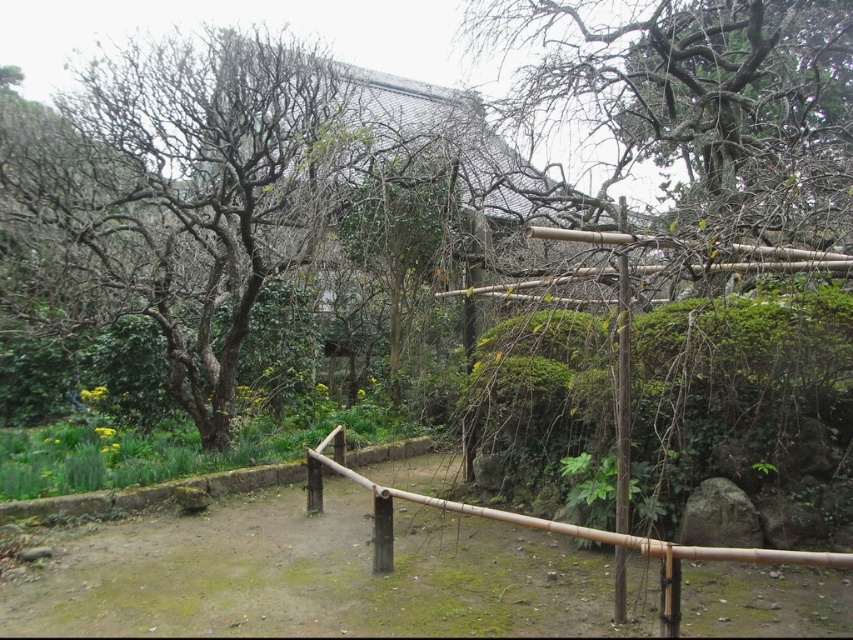
Does point (22, 129) lie in front of point (621, 497)?

No, (22, 129) is further to viewer.

Who is positioned more to the left, bare wood tree at left or bamboo pole at center?

bare wood tree at left is more to the left.

Does point (223, 61) come behind point (624, 200)?

That is True.

The image size is (853, 640). I want to click on bare wood tree at left, so click(x=186, y=189).

Is bamboo fence at center below bamboo pole at center?

Indeed, bamboo fence at center is positioned under bamboo pole at center.

Who is more forward, (666, 552) or (628, 422)?

Point (666, 552) is in front.

Where is `bamboo fence at center`? This screenshot has height=640, width=853. bamboo fence at center is located at coordinates (544, 531).

The width and height of the screenshot is (853, 640). I want to click on bamboo fence at center, so click(x=544, y=531).

Can you confirm if bare wood tree at left is positioned to the left of bamboo fence at center?

Indeed, bare wood tree at left is positioned on the left side of bamboo fence at center.

Which is behind, point (200, 173) or point (548, 518)?

The point (200, 173) is behind.

Image resolution: width=853 pixels, height=640 pixels. I want to click on bare wood tree at left, so click(186, 189).